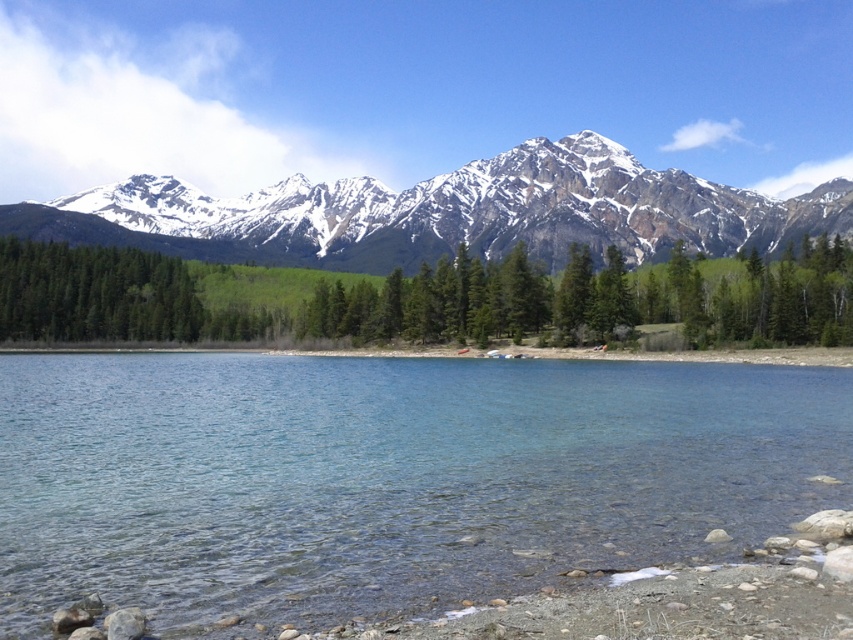
Measure the distance from snowy granite mountain range at upper center to green matte trees at center.

140.60 meters

Is snowy granite mountain range at upper center below green matte trees at center?

No.

Where is `snowy granite mountain range at upper center`? snowy granite mountain range at upper center is located at coordinates click(x=451, y=212).

Where is `snowy granite mountain range at upper center`? Image resolution: width=853 pixels, height=640 pixels. snowy granite mountain range at upper center is located at coordinates tap(451, 212).

This screenshot has width=853, height=640. What do you see at coordinates (386, 476) in the screenshot?
I see `clear glass water at center` at bounding box center [386, 476].

Between clear glass water at center and snowy granite mountain range at upper center, which one has more height?

Standing taller between the two is snowy granite mountain range at upper center.

Locate an element on the screen. The width and height of the screenshot is (853, 640). clear glass water at center is located at coordinates (x=386, y=476).

Between clear glass water at center and green matte trees at center, which one is positioned higher?

green matte trees at center is higher up.

Image resolution: width=853 pixels, height=640 pixels. What do you see at coordinates (386, 476) in the screenshot?
I see `clear glass water at center` at bounding box center [386, 476].

Describe the element at coordinates (386, 476) in the screenshot. Image resolution: width=853 pixels, height=640 pixels. I see `clear glass water at center` at that location.

At what (x,y) coordinates should I click in order to perform the action: click on clear glass water at center. Please return your answer as a coordinate pair (x, y). The image size is (853, 640). Looking at the image, I should click on tap(386, 476).